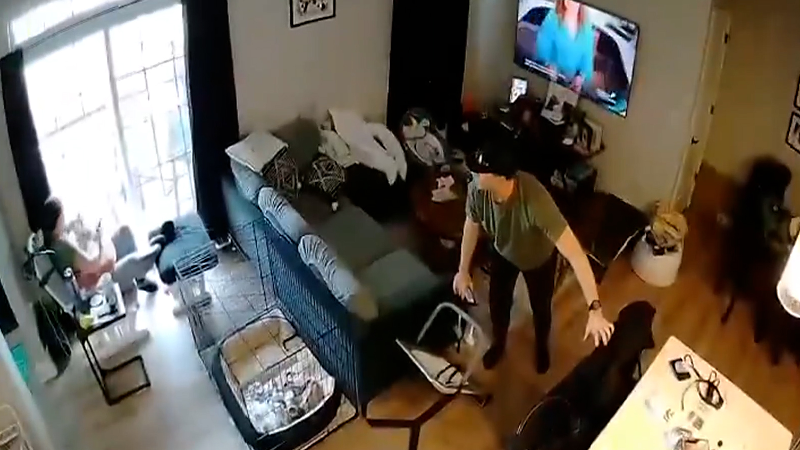
The width and height of the screenshot is (800, 450). I want to click on couch, so click(x=384, y=265).